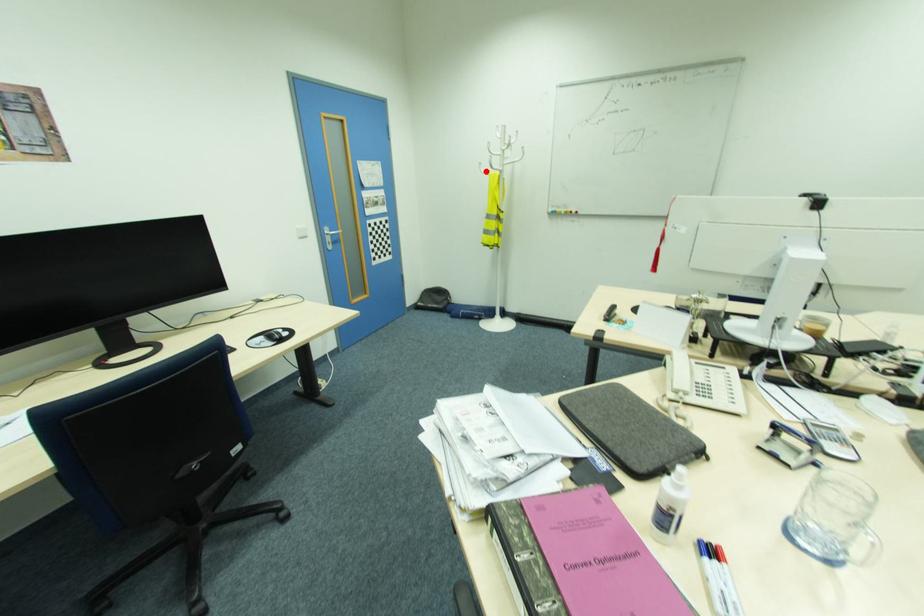
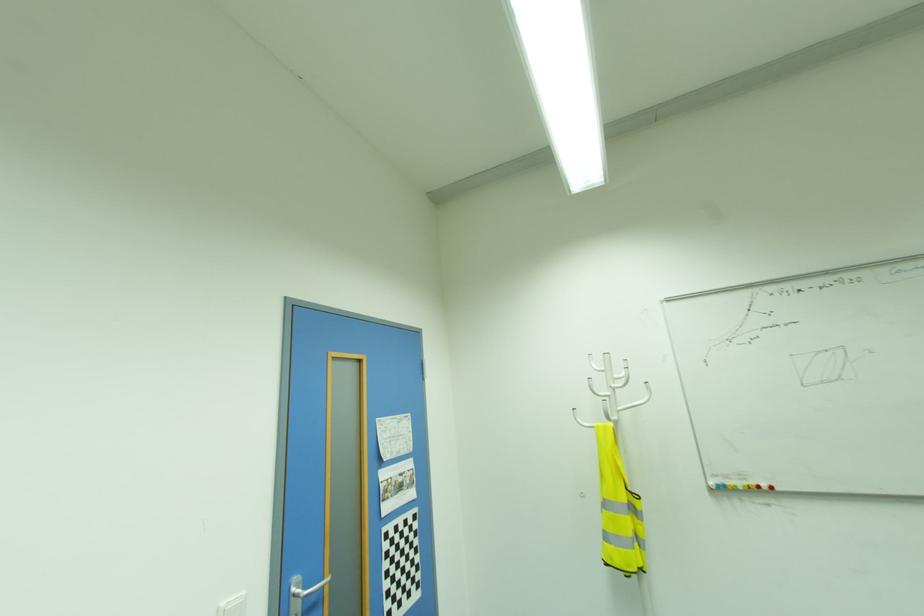
The point at the highlighted location is marked in the first image. Where is the corresponding point in the second image?

(589, 424)